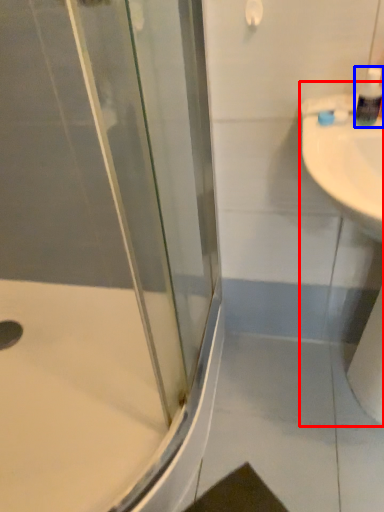
Question: Among these objects, which one is farthest to the camera, sink (highlighted by a red box) or soap dispenser (highlighted by a blue box)?

Choices:
 (A) sink
 (B) soap dispenser

Answer: (B)